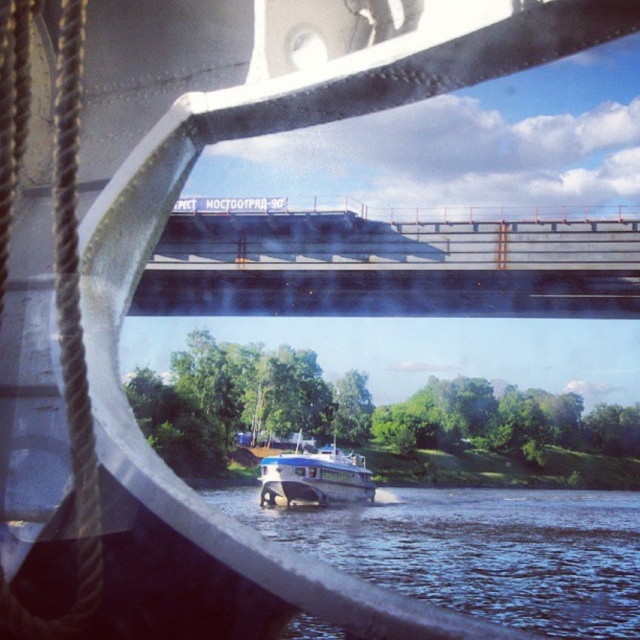
Question: Does concrete bridge at center have a larger size compared to blue glossy boat at center?

Choices:
 (A) yes
 (B) no

Answer: (A)

Question: Which point is closer to the camera taking this photo?

Choices:
 (A) (278, 278)
 (B) (300, 483)
 (C) (438, 502)

Answer: (A)

Question: Which point is closer to the camera taking this photo?

Choices:
 (A) (426, 538)
 (B) (536, 316)

Answer: (A)

Question: Estimate the real-world distances between objects in this image. Which object is closer to the concrete bridge at center?

Choices:
 (A) blue water at lower center
 (B) blue glossy boat at center

Answer: (B)

Question: In this image, where is blue water at lower center located relative to blue glossy boat at center?

Choices:
 (A) above
 (B) below

Answer: (B)

Question: Is concrete bridge at center to the left of blue water at lower center from the viewer's perspective?

Choices:
 (A) yes
 (B) no

Answer: (A)